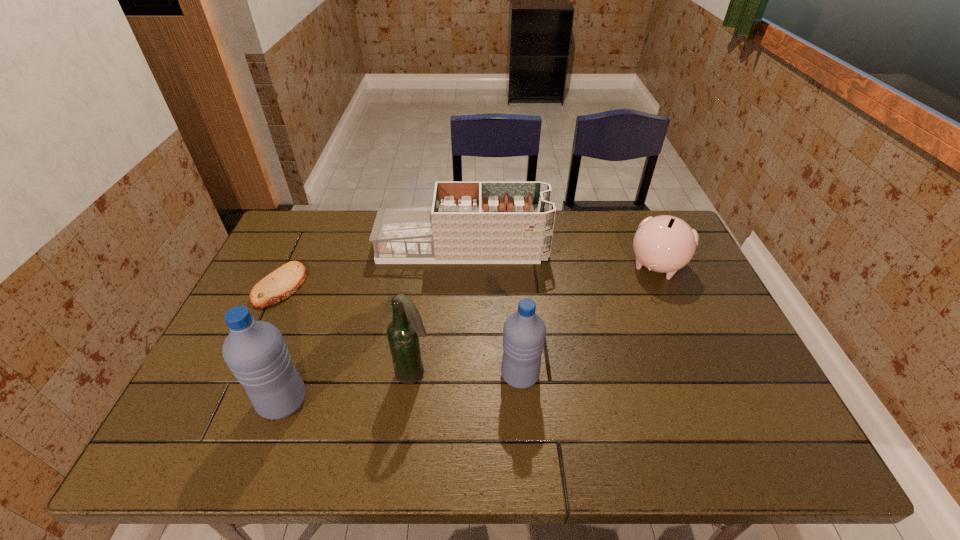
Locate an element on the screen. vacant area between the piggy bank and the dollhouse is located at coordinates (560, 256).

At what (x,y) coordinates should I click in order to perform the action: click on free space between the dollhouse and the right water bottle. Please return your answer as a coordinate pair (x, y). Looking at the image, I should click on (492, 312).

Identify the location of free space between the rightmost object and the second object from left to right. This screenshot has width=960, height=540. (469, 334).

The image size is (960, 540). Find the location of `free space between the fifth object from right to left and the piggy bank`. free space between the fifth object from right to left and the piggy bank is located at coordinates (469, 334).

Find the location of a particular element. This screenshot has width=960, height=540. vacant region between the beer bottle and the taller water bottle is located at coordinates (348, 388).

Find the location of a particular element. vacant area between the beer bottle and the dollhouse is located at coordinates (439, 310).

Locate an element on the screen. This screenshot has height=540, width=960. free space between the rightmost object and the shorter water bottle is located at coordinates (588, 321).

This screenshot has height=540, width=960. I want to click on unoccupied area between the right water bottle and the piggy bank, so click(x=588, y=321).

Where is `object that is the third nearest to the shortest object`? object that is the third nearest to the shortest object is located at coordinates (403, 333).

Where is `object that stands as the closest to the taller water bottle`? object that stands as the closest to the taller water bottle is located at coordinates (403, 333).